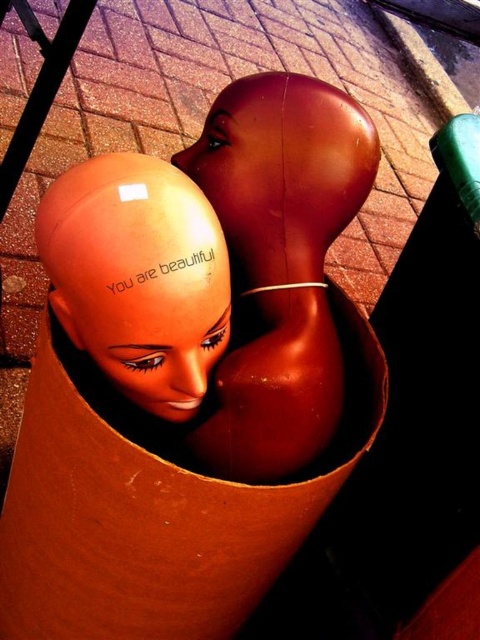
You are an artist setting up an outdoor exhibition. You have two heads displayed in a cardboard tube. The matte orange head at center and the glossy plastic head at center. Which one is positioned lower in the tube?

The matte orange head at center is located below the glossy plastic head at center, so it is positioned lower in the tube.

You are standing in front of the scene described. There is a glossy brown mannequin head at center. Can you determine its exact position using the coordinate system provided?

The glossy brown mannequin head at center is located at point (279, 260) according to the coordinate system provided.